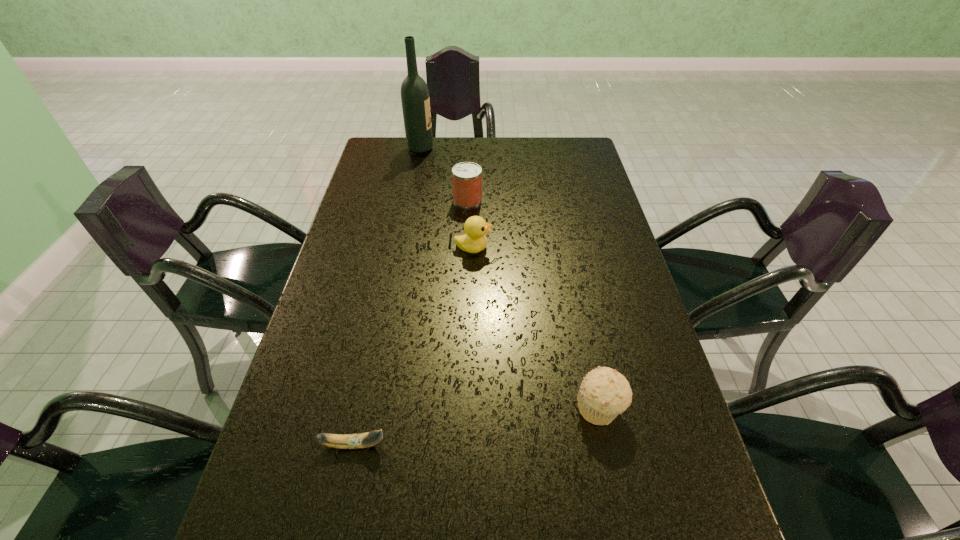
Identify the location of vacant area between the third farthest object and the shortest object. 414,346.

Identify which object is located as the nearest to the farthest object. Please provide its 2D coordinates. Your answer should be formatted as a tuple, i.e. [(x, y)], where the tuple contains the x and y coordinates of a point satisfying the conditions above.

[(467, 176)]

At what (x,y) coordinates should I click in order to perform the action: click on the third closest object to the banana. Please return your answer as a coordinate pair (x, y). Image resolution: width=960 pixels, height=540 pixels. Looking at the image, I should click on (467, 176).

Where is `free point that satisfies the following two spatial constraints: 1. on the back side of the muffin; 2. on the labeled side of the tallest object`? Image resolution: width=960 pixels, height=540 pixels. free point that satisfies the following two spatial constraints: 1. on the back side of the muffin; 2. on the labeled side of the tallest object is located at coordinates (545, 148).

Where is `free space that satisfies the following two spatial constraints: 1. on the back side of the fourth farthest object; 2. on the face of the third nearest object`? The width and height of the screenshot is (960, 540). free space that satisfies the following two spatial constraints: 1. on the back side of the fourth farthest object; 2. on the face of the third nearest object is located at coordinates (566, 248).

Identify the location of vacant space that satisfies the following two spatial constraints: 1. on the back side of the muffin; 2. on the labeled side of the wine bottle. (545, 148).